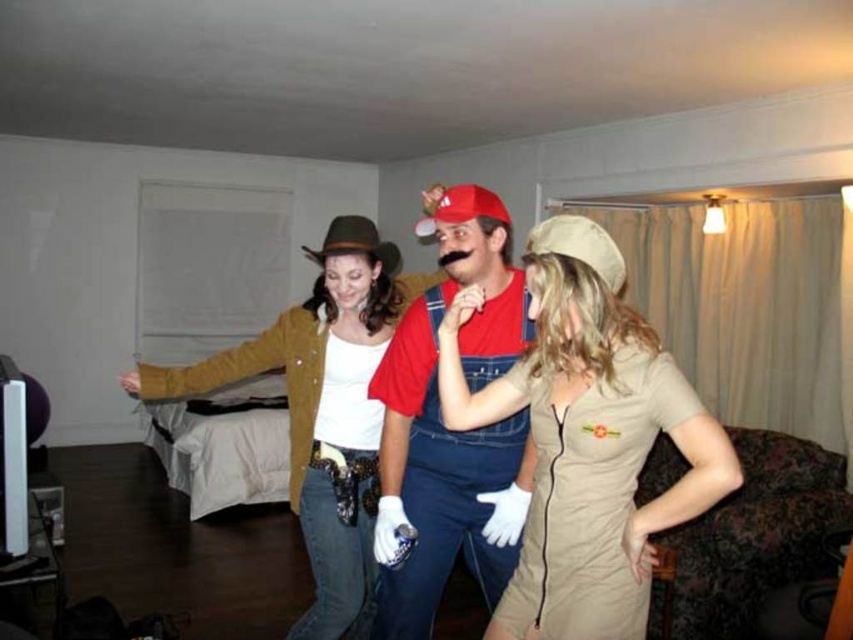
Question: Which point is farther to the camera?

Choices:
 (A) (421, 492)
 (B) (317, 435)
 (C) (447, 490)

Answer: (B)

Question: Is tan fabric dress at center above brown felt hat at center?

Choices:
 (A) yes
 (B) no

Answer: (A)

Question: Considering the real-world distances, which object is closest to the tan fabric dress at center?

Choices:
 (A) matte red shirt at center
 (B) brown felt hat at center
 (C) red cotton overalls at center

Answer: (C)

Question: From the image, what is the correct spatial relationship of red cotton overalls at center in relation to brown felt hat at center?

Choices:
 (A) below
 (B) above

Answer: (B)

Question: Which of these objects is positioned farthest from the matte red shirt at center?

Choices:
 (A) brown felt hat at center
 (B) red cotton overalls at center

Answer: (A)

Question: Can you confirm if red cotton overalls at center is bigger than brown felt hat at center?

Choices:
 (A) yes
 (B) no

Answer: (A)